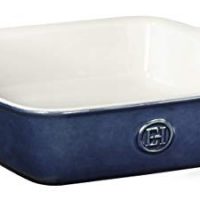
Where is `front lip of bowl`? The width and height of the screenshot is (200, 200). front lip of bowl is located at coordinates (143, 103).